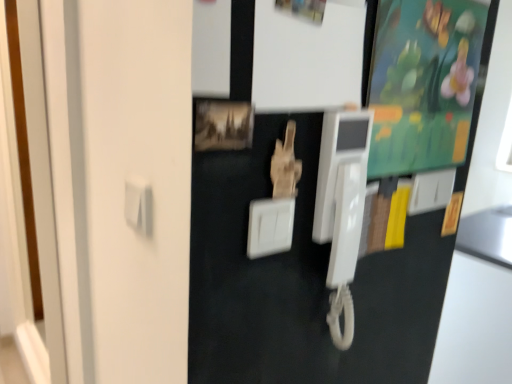
Question: Is wooden photo frame at center turned away from white plastic payphone at center?

Choices:
 (A) no
 (B) yes

Answer: (A)

Question: Does wooden photo frame at center have a greater width compared to white plastic payphone at center?

Choices:
 (A) yes
 (B) no

Answer: (B)

Question: Are wooden photo frame at center and white plastic payphone at center beside each other?

Choices:
 (A) no
 (B) yes

Answer: (A)

Question: Is wooden photo frame at center surrounding white plastic payphone at center?

Choices:
 (A) no
 (B) yes

Answer: (A)

Question: From a real-world perspective, is wooden photo frame at center under white plastic payphone at center?

Choices:
 (A) no
 (B) yes

Answer: (A)

Question: Is wooden photo frame at center oriented towards white plastic payphone at center?

Choices:
 (A) yes
 (B) no

Answer: (B)

Question: From a real-world perspective, is white plastic payphone at center physically above wooden photo frame at center?

Choices:
 (A) yes
 (B) no

Answer: (B)

Question: Does white plastic payphone at center have a lesser width compared to wooden photo frame at center?

Choices:
 (A) no
 (B) yes

Answer: (A)

Question: Considering the relative sizes of white plastic payphone at center and wooden photo frame at center in the image provided, is white plastic payphone at center wider than wooden photo frame at center?

Choices:
 (A) no
 (B) yes

Answer: (B)

Question: From the image's perspective, is white plastic payphone at center located beneath wooden photo frame at center?

Choices:
 (A) yes
 (B) no

Answer: (A)

Question: Is white plastic payphone at center facing towards wooden photo frame at center?

Choices:
 (A) yes
 (B) no

Answer: (B)

Question: Considering the relative sizes of white plastic payphone at center and wooden photo frame at center in the image provided, is white plastic payphone at center taller than wooden photo frame at center?

Choices:
 (A) no
 (B) yes

Answer: (B)

Question: From a real-world perspective, is white plastic light switch at upper right, the first light switch positioned from the back, beneath wooden photo frame at center?

Choices:
 (A) no
 (B) yes

Answer: (B)